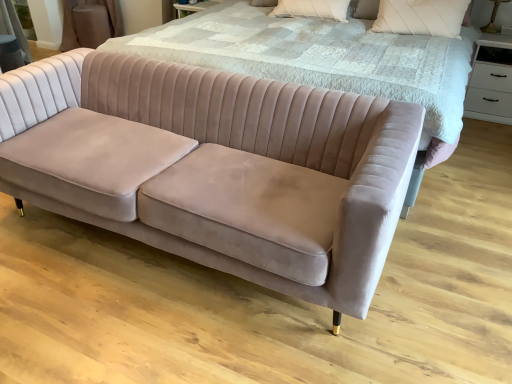
Question: Is the depth of white glossy drawer at upper right greater than that of matte gold table lamp at upper right?

Choices:
 (A) no
 (B) yes

Answer: (A)

Question: From the image's perspective, is white glossy drawer at upper right over matte gold table lamp at upper right?

Choices:
 (A) no
 (B) yes

Answer: (A)

Question: Can you confirm if white glossy drawer at upper right is positioned to the right of matte gold table lamp at upper right?

Choices:
 (A) no
 (B) yes

Answer: (B)

Question: Is white glossy drawer at upper right not close to matte gold table lamp at upper right?

Choices:
 (A) yes
 (B) no

Answer: (B)

Question: Is white glossy drawer at upper right turned away from matte gold table lamp at upper right?

Choices:
 (A) yes
 (B) no

Answer: (B)

Question: From a real-world perspective, relative to white textured pillow at upper center, positioned as the 1th pillow in left-to-right order, is white glossy drawer at upper right vertically above or below?

Choices:
 (A) below
 (B) above

Answer: (A)

Question: Is point (498, 64) positioned closer to the camera than point (287, 4)?

Choices:
 (A) closer
 (B) farther

Answer: (B)

Question: Is white glossy drawer at upper right to the left or to the right of white textured pillow at upper center, positioned as the 1th pillow in left-to-right order, in the image?

Choices:
 (A) right
 (B) left

Answer: (A)

Question: Would you say white glossy drawer at upper right is inside or outside white textured pillow at upper center, positioned as the second pillow in right-to-left order?

Choices:
 (A) inside
 (B) outside

Answer: (B)

Question: From the image's perspective, is velvet bed at center located above or below white textured pillow at upper right, marked as the first pillow in a right-to-left arrangement?

Choices:
 (A) below
 (B) above

Answer: (A)

Question: Is velvet bed at center wider or thinner than white textured pillow at upper right, marked as the first pillow in a right-to-left arrangement?

Choices:
 (A) thin
 (B) wide

Answer: (B)

Question: Considering the positions of velvet bed at center and white textured pillow at upper right, marked as the first pillow in a right-to-left arrangement, in the image, is velvet bed at center bigger or smaller than white textured pillow at upper right, marked as the first pillow in a right-to-left arrangement,?

Choices:
 (A) big
 (B) small

Answer: (A)

Question: From a real-world perspective, is velvet bed at center physically located above or below white textured pillow at upper right, which is the 2th pillow in left-to-right order?

Choices:
 (A) below
 (B) above

Answer: (A)

Question: Considering the positions of matte gold table lamp at upper right and velvet bed at center in the image, is matte gold table lamp at upper right bigger or smaller than velvet bed at center?

Choices:
 (A) big
 (B) small

Answer: (B)

Question: Is matte gold table lamp at upper right to the left or to the right of velvet bed at center in the image?

Choices:
 (A) left
 (B) right

Answer: (B)